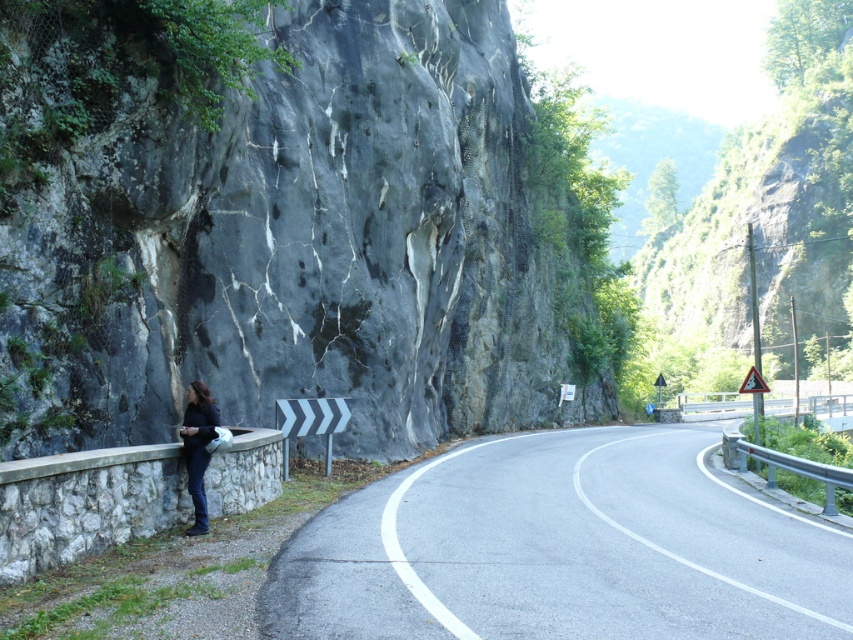
Does black asphalt road at center appear on the left side of stone at left?

In fact, black asphalt road at center is to the right of stone at left.

Where is `black asphalt road at center`? This screenshot has height=640, width=853. black asphalt road at center is located at coordinates (561, 548).

Locate an element on the screen. The image size is (853, 640). black asphalt road at center is located at coordinates (561, 548).

Between black asphalt road at center and metallic gray barrier at right, which one appears on the right side from the viewer's perspective?

Positioned to the right is metallic gray barrier at right.

Does black asphalt road at center have a larger size compared to metallic gray barrier at right?

No.

Between point (822, 616) and point (727, 452), which one is positioned behind?

The point (727, 452) is more distant.

Where is `black asphalt road at center`? This screenshot has height=640, width=853. black asphalt road at center is located at coordinates (561, 548).

How distant is stone at left from dark blue jeans at left?

stone at left and dark blue jeans at left are 7.85 feet apart.

Can you confirm if stone at left is shorter than dark blue jeans at left?

Correct, stone at left is not as tall as dark blue jeans at left.

Describe the element at coordinates (85, 504) in the screenshot. I see `stone at left` at that location.

The height and width of the screenshot is (640, 853). What are the coordinates of `stone at left` in the screenshot? It's located at pyautogui.click(x=85, y=504).